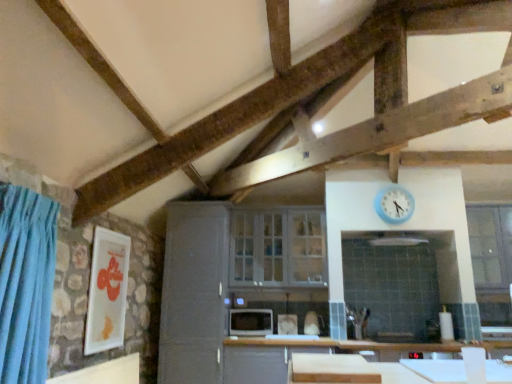
Question: Choose the correct answer: Is blue plastic clock at upper right inside white glass cabinet at center, marked as the first window in a left-to-right arrangement, or outside it?

Choices:
 (A) inside
 (B) outside

Answer: (B)

Question: In terms of width, does blue plastic clock at upper right look wider or thinner when compared to white glass cabinet at center, acting as the 2th window starting from the right?

Choices:
 (A) thin
 (B) wide

Answer: (A)

Question: Considering the real-world distances, which object is closest to the blue velvet curtain at left?

Choices:
 (A) blue plastic clock at upper right
 (B) matte white picture frame at left
 (C) satin gray cabinet at center
 (D) white matte cutting board at lower center
 (E) white glass cabinet at center, acting as the 2th window starting from the right

Answer: (B)

Question: Estimate the real-world distances between objects in this image. Which object is closer to the blue plastic clock at upper right?

Choices:
 (A) white matte cutting board at lower center
 (B) satin gray cabinet at center
 (C) blue velvet curtain at left
 (D) matte black microwave at center
 (E) white glass cabinet at center, marked as the first window in a left-to-right arrangement

Answer: (E)